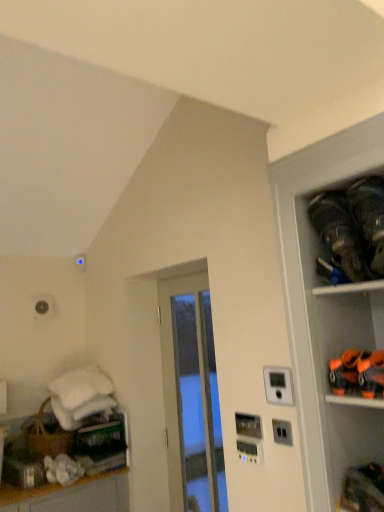
Image resolution: width=384 pixels, height=512 pixels. Describe the element at coordinates (351, 230) in the screenshot. I see `black fabric shoes at upper right` at that location.

Identify the location of black fabric shoes at upper right. Image resolution: width=384 pixels, height=512 pixels. (351, 230).

From the picture: What is the approximate width of black fabric shoes at upper right?

black fabric shoes at upper right is 6.92 inches in width.

This screenshot has width=384, height=512. I want to click on transparent glass door at center, so click(x=191, y=396).

Describe the element at coordinates (191, 396) in the screenshot. The image size is (384, 512). I see `transparent glass door at center` at that location.

Where is `black fabric shoes at upper right`? Image resolution: width=384 pixels, height=512 pixels. black fabric shoes at upper right is located at coordinates (351, 230).

Considering the positions of objects transparent glass door at center and black fabric shoes at upper right in the image provided, who is more to the left, transparent glass door at center or black fabric shoes at upper right?

From the viewer's perspective, transparent glass door at center appears more on the left side.

Who is more distant, transparent glass door at center or black fabric shoes at upper right?

transparent glass door at center is further away from the camera.

Consider the image. Which is closer to the camera, (199, 334) or (354, 265)?

The point (354, 265) is closer.

From the image's perspective, is transparent glass door at center on black fabric shoes at upper right?

Incorrect, from the image's perspective, transparent glass door at center is lower than black fabric shoes at upper right.

From a real-world perspective, between transparent glass door at center and black fabric shoes at upper right, who is vertically higher?

From a 3D spatial view, black fabric shoes at upper right is above.

Which of these two, transparent glass door at center or black fabric shoes at upper right, is wider?

black fabric shoes at upper right is wider.

Is transparent glass door at center taller or shorter than black fabric shoes at upper right?

Considering their sizes, transparent glass door at center has more height than black fabric shoes at upper right.

Considering the relative sizes of transparent glass door at center and black fabric shoes at upper right in the image provided, is transparent glass door at center smaller than black fabric shoes at upper right?

Actually, transparent glass door at center might be larger than black fabric shoes at upper right.

Is transparent glass door at center situated inside black fabric shoes at upper right or outside?

The correct answer is: outside.

Is there a large distance between transparent glass door at center and black fabric shoes at upper right?

transparent glass door at center is far away from black fabric shoes at upper right.

Is transparent glass door at center facing away from black fabric shoes at upper right?

No.

The image size is (384, 512). I want to click on shelf on the right of transparent glass door at center, so click(x=351, y=230).

Considering the relative positions of black fabric shoes at upper right and transparent glass door at center in the image provided, is black fabric shoes at upper right to the left or to the right of transparent glass door at center?

From the image, it's evident that black fabric shoes at upper right is to the right of transparent glass door at center.

Does black fabric shoes at upper right lie in front of transparent glass door at center?

Yes, black fabric shoes at upper right is in front of transparent glass door at center.

Which is closer, [351,209] or [192,311]?

Point [351,209] is positioned closer to the camera compared to point [192,311].

From the image's perspective, which is below, black fabric shoes at upper right or transparent glass door at center?

From the image's view, transparent glass door at center is below.

From a real-world perspective, relative to transparent glass door at center, is black fabric shoes at upper right vertically above or below?

In terms of real-world spatial position, black fabric shoes at upper right is above transparent glass door at center.

Looking at their sizes, would you say black fabric shoes at upper right is wider or thinner than transparent glass door at center?

Clearly, black fabric shoes at upper right has more width compared to transparent glass door at center.

From their relative heights in the image, would you say black fabric shoes at upper right is taller or shorter than transparent glass door at center?

In the image, black fabric shoes at upper right appears to be shorter than transparent glass door at center.

Looking at this image, is black fabric shoes at upper right smaller than transparent glass door at center?

Yes, black fabric shoes at upper right is smaller than transparent glass door at center.

Is black fabric shoes at upper right inside the boundaries of transparent glass door at center, or outside?

black fabric shoes at upper right is located beyond the bounds of transparent glass door at center.

Is black fabric shoes at upper right beside transparent glass door at center?

No.

In the scene shown: Is black fabric shoes at upper right turned away from transparent glass door at center?

No.

The height and width of the screenshot is (512, 384). In order to click on shelf in front of the transparent glass door at center in this screenshot , I will do `click(351, 230)`.

Identify the location of door behind the black fabric shoes at upper right. The width and height of the screenshot is (384, 512). [x=191, y=396].

This screenshot has width=384, height=512. I want to click on shelf located in front of the transparent glass door at center, so click(351, 230).